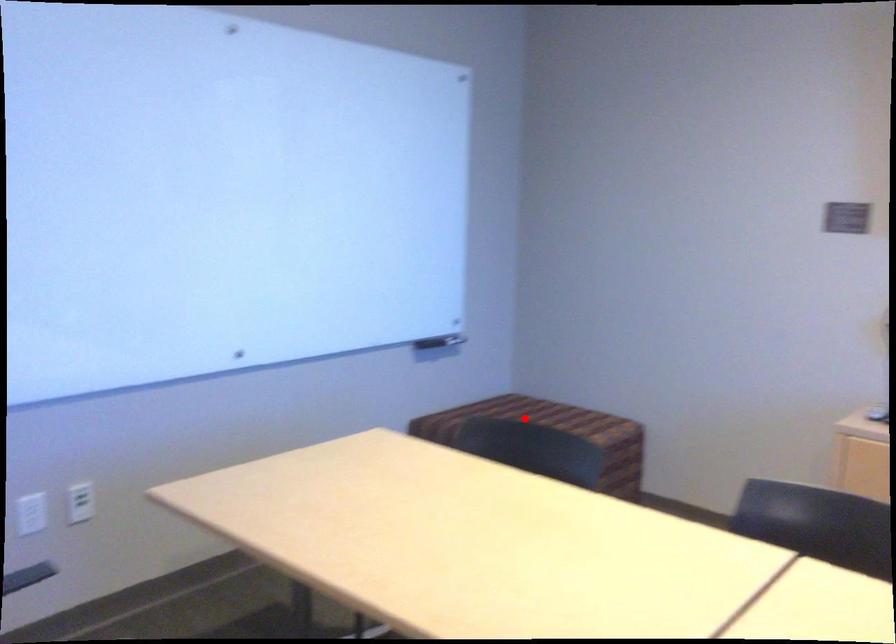
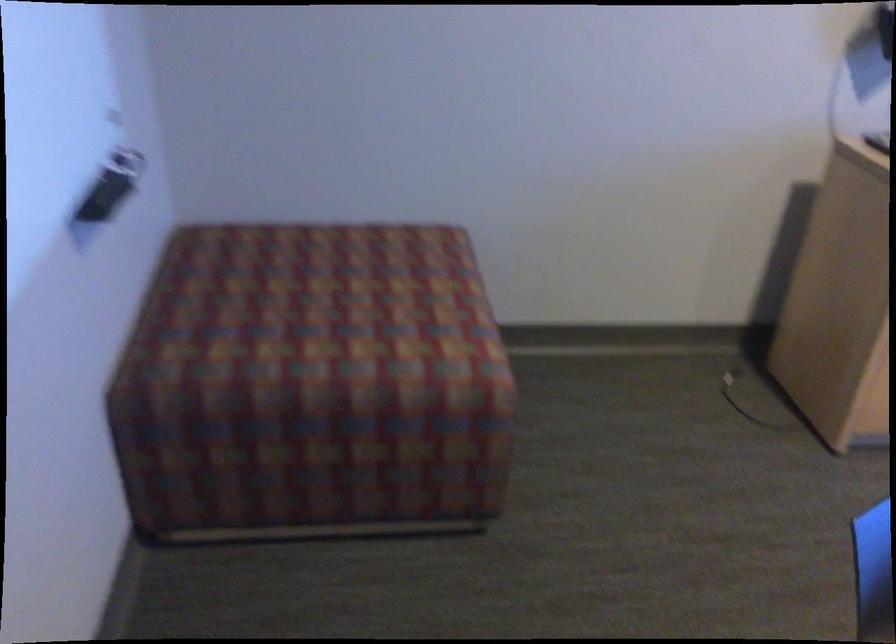
Question: I am providing you with two images of the same scene from different viewpoints. A red point is shown in image1. For the corresponding object point in image2, is it positioned nearer or farther from the camera?

Choices:
 (A) Nearer
 (B) Farther

Answer: (A)